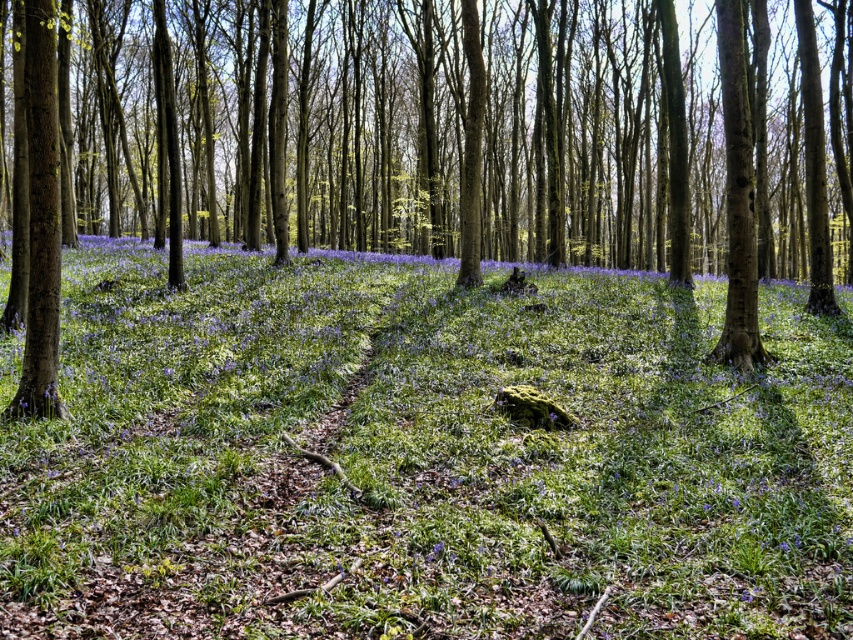
Question: In this image, where is green matte grass at center located relative to brown smooth tree trunk at center?

Choices:
 (A) below
 (B) above

Answer: (A)

Question: Is green matte grass at center above brown smooth tree trunk at center?

Choices:
 (A) no
 (B) yes

Answer: (A)

Question: Does green matte grass at center appear on the right side of brown smooth tree trunk at center?

Choices:
 (A) yes
 (B) no

Answer: (A)

Question: Among these objects, which one is farthest from the camera?

Choices:
 (A) brown smooth tree trunk at center
 (B) green matte grass at center

Answer: (A)